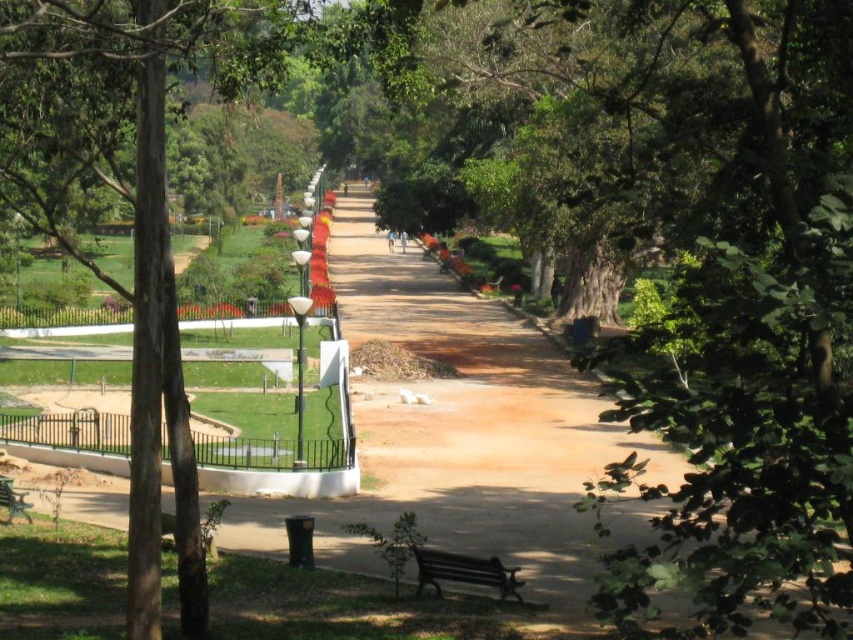
Can you confirm if brown wood tree at left is shorter than green painted wood bench at lower left?

In fact, brown wood tree at left may be taller than green painted wood bench at lower left.

Find the location of a particular element. The width and height of the screenshot is (853, 640). brown wood tree at left is located at coordinates (128, 202).

Consider the image. Measure the distance between point (171, 385) and camera.

A distance of 12.96 meters exists between point (171, 385) and camera.

What are the coordinates of `brown wood tree at left` in the screenshot? It's located at (128, 202).

What do you see at coordinates (463, 572) in the screenshot?
I see `wooden bench at lower center` at bounding box center [463, 572].

Between wooden bench at lower center and green painted wood bench at lower left, which one is positioned higher?

green painted wood bench at lower left

Is point (428, 573) more distant than point (6, 493)?

No, (428, 573) is closer to viewer.

Find the location of a particular element. The width and height of the screenshot is (853, 640). wooden bench at lower center is located at coordinates (463, 572).

Can you confirm if brown wood tree at left is positioned above wooden bench at lower center?

Indeed, brown wood tree at left is positioned over wooden bench at lower center.

Who is shorter, brown wood tree at left or wooden bench at lower center?

wooden bench at lower center is shorter.

At what (x,y) coordinates should I click in order to perform the action: click on brown wood tree at left. Please return your answer as a coordinate pair (x, y). The image size is (853, 640). Looking at the image, I should click on (128, 202).